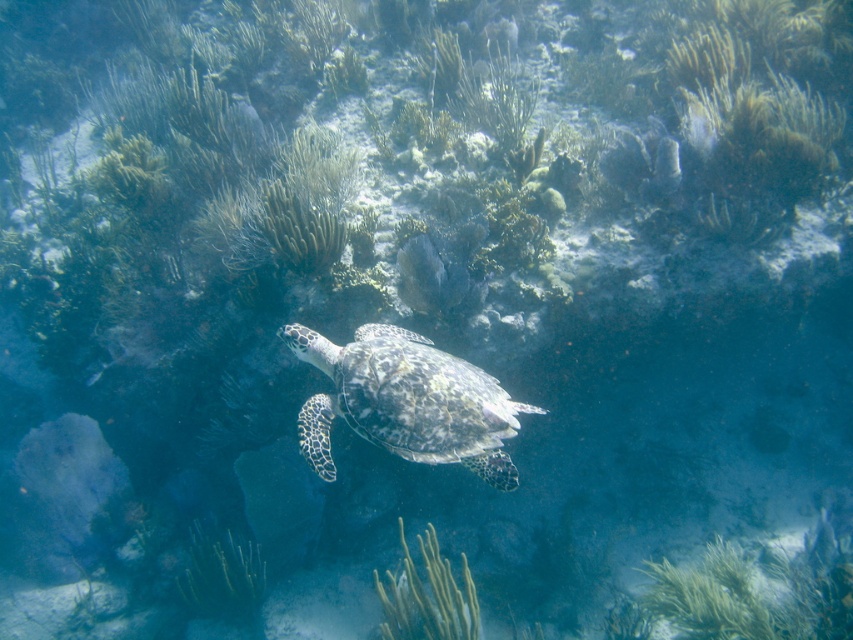
Can you confirm if speckled shell turtle at center is shorter than green soft coral at center?

Indeed, speckled shell turtle at center has a lesser height compared to green soft coral at center.

Between point (434, 381) and point (381, 634), which one is positioned behind?

Positioned behind is point (381, 634).

This screenshot has width=853, height=640. What do you see at coordinates (405, 401) in the screenshot?
I see `speckled shell turtle at center` at bounding box center [405, 401].

Locate an element on the screen. speckled shell turtle at center is located at coordinates (405, 401).